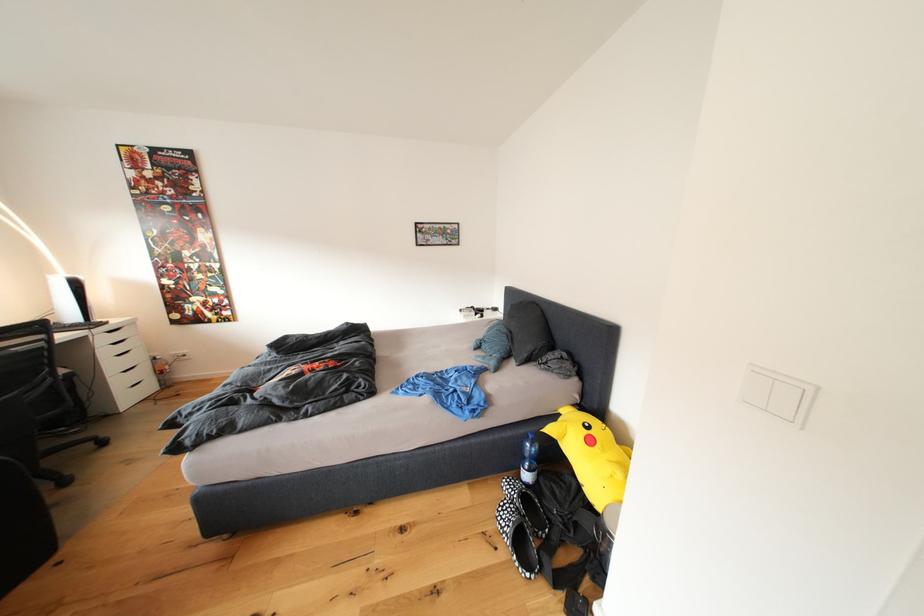
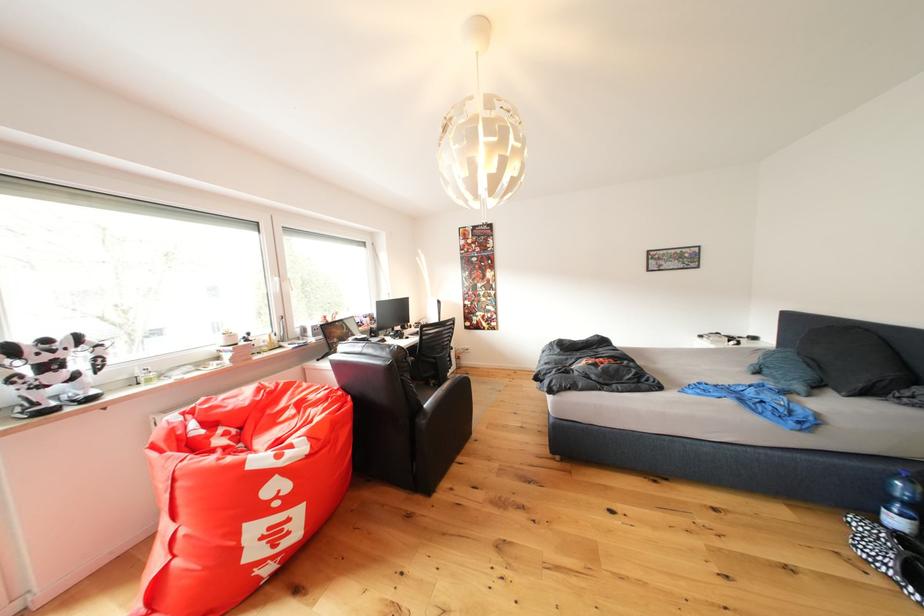
In the second image, find the point that corresponds to (536,480) in the first image.

(906, 527)